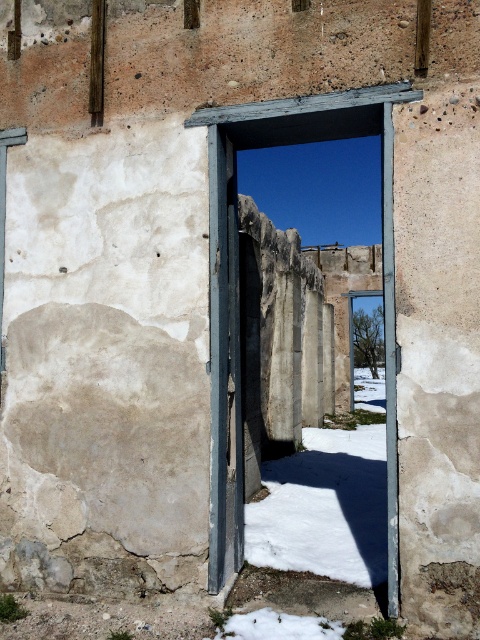
You are standing in front of the weathered building depicted in the image. You notice a point marked at coordinates (228, 252). Based on the scene description, what does this point most likely represent?

The point at (228, 252) most likely represents the wooden door frame at center, as it is the central feature of the structure and the coordinates align with its position.

You are a painter who needs to apply a protective coating to the wooden door frame at center and the rusty metal door at center. The spray can you have can only reach surfaces within 15 centimeters. Can you spray both objects without moving the spray can?

The wooden door frame at center is 17.65 centimeters from rusty metal door at center. Since the spray can can only reach within 15 centimeters, you cannot spray both objects without moving the spray can because the distance between them exceeds the spray can range.